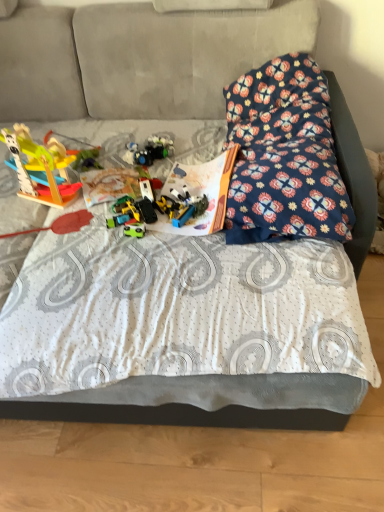
What do you see at coordinates (284, 156) in the screenshot? I see `floral fabric pillow at upper right` at bounding box center [284, 156].

Identify the location of hardcover book at center. (201, 193).

Describe the element at coordinates (126, 217) in the screenshot. I see `shiny plastic toy car at center, placed as the 4th toy when sorted from right to left` at that location.

Locate an element on the screen. The width and height of the screenshot is (384, 512). plastic toy car at center, the sixth toy when ordered from left to right is located at coordinates (181, 206).

Is shiny plastic toy car at center, placed as the 4th toy when sorted from right to left, turned away from green plastic toy car at center, placed as the fourth toy when sorted from left to right?

No, green plastic toy car at center, placed as the fourth toy when sorted from left to right, is not at the back of shiny plastic toy car at center, placed as the 4th toy when sorted from right to left.

Starting from the shiny plastic toy car at center, arranged as the 3th toy when viewed from the left, which toy is the 2nd one in front? Please provide its 2D coordinates.

[(134, 230)]

Is shiny plastic toy car at center, placed as the 4th toy when sorted from right to left, not near green plastic toy car at center, placed as the fourth toy when sorted from left to right?

They are positioned close to each other.

Is shiny plastic toy car at center, placed as the 4th toy when sorted from right to left, shorter than green plastic toy car at center, which is the 3th toy from right to left?

In fact, shiny plastic toy car at center, placed as the 4th toy when sorted from right to left, may be taller than green plastic toy car at center, which is the 3th toy from right to left.

From a real-world perspective, between translucent plastic toys at center, acting as the 2th toy starting from the right, and plastic toy car at center, which is counted as the first toy, starting from the right, who is vertically lower?

plastic toy car at center, which is counted as the first toy, starting from the right, from a real-world perspective.

How much distance is there between translucent plastic toys at center, acting as the 2th toy starting from the right, and plastic toy car at center, which is counted as the first toy, starting from the right?

A distance of 12.71 inches exists between translucent plastic toys at center, acting as the 2th toy starting from the right, and plastic toy car at center, which is counted as the first toy, starting from the right.

Does translucent plastic toys at center, acting as the 2th toy starting from the right, turn towards plastic toy car at center, the sixth toy when ordered from left to right?

Yes, translucent plastic toys at center, acting as the 2th toy starting from the right, is oriented towards plastic toy car at center, the sixth toy when ordered from left to right.

Between point (127, 155) and point (173, 205), which one is positioned in front?

Point (173, 205)

From a real-world perspective, which object rests below the other?

In real-world perspective, green plastic toy car at center, which is the 3th toy from right to left, is lower.

From the image's perspective, which one is positioned higher, green plastic toy at center, placed as the 5th toy when sorted from right to left, or green plastic toy car at center, which is the 3th toy from right to left?

green plastic toy at center, placed as the 5th toy when sorted from right to left, appears higher in the image.

Does green plastic toy at center, placed as the 5th toy when sorted from right to left, come behind green plastic toy car at center, placed as the fourth toy when sorted from left to right?

Yes, the depth of green plastic toy at center, placed as the 5th toy when sorted from right to left, is greater than that of green plastic toy car at center, placed as the fourth toy when sorted from left to right.

Is white textured sheet at center in front of or behind shiny plastic toy car at center, placed as the 4th toy when sorted from right to left, in the image?

In the image, white textured sheet at center appears in front of shiny plastic toy car at center, placed as the 4th toy when sorted from right to left.

Is white textured sheet at center at the right side of shiny plastic toy car at center, arranged as the 3th toy when viewed from the left?

Yes.

Do you think white textured sheet at center is within shiny plastic toy car at center, placed as the 4th toy when sorted from right to left, or outside of it?

The correct answer is: outside.

Is white textured sheet at center wider than shiny plastic toy car at center, placed as the 4th toy when sorted from right to left?

Yes.

From a real-world perspective, between white textured sheet at center and green plastic toy at center, placed as the 5th toy when sorted from right to left, who is vertically higher?

From a 3D spatial view, green plastic toy at center, placed as the 5th toy when sorted from right to left, is above.

Locate an element on the screen. the 5th toy to the left when counting from the white textured sheet at center is located at coordinates tap(87, 160).

Is white textured sheet at center not near green plastic toy at center, placed as the 5th toy when sorted from right to left?

They are positioned close to each other.

From the image's perspective, who appears lower, white textured sheet at center or green plastic toy at center, placed as the 5th toy when sorted from right to left?

white textured sheet at center.

Is shiny plastic toy car at center, placed as the 4th toy when sorted from right to left, bigger than green plastic toy at center, which ranks as the second toy in left-to-right order?

Indeed, shiny plastic toy car at center, placed as the 4th toy when sorted from right to left, has a larger size compared to green plastic toy at center, which ranks as the second toy in left-to-right order.

Is point (128, 228) positioned in front of point (81, 167)?

Yes, point (128, 228) is closer to viewer.

From a real-world perspective, who is located higher, shiny plastic toy car at center, placed as the 4th toy when sorted from right to left, or green plastic toy at center, placed as the 5th toy when sorted from right to left?

green plastic toy at center, placed as the 5th toy when sorted from right to left, from a real-world perspective.

Can you confirm if shiny plastic toy car at center, arranged as the 3th toy when viewed from the left, is shorter than green plastic toy at center, placed as the 5th toy when sorted from right to left?

Incorrect, the height of shiny plastic toy car at center, arranged as the 3th toy when viewed from the left, does not fall short of that of green plastic toy at center, placed as the 5th toy when sorted from right to left.

Does shiny plastic toy car at center, placed as the 4th toy when sorted from right to left, turn towards wooden toy at left, which is the sixth toy in right-to-left order?

No, shiny plastic toy car at center, placed as the 4th toy when sorted from right to left, is not turned towards wooden toy at left, which is the sixth toy in right-to-left order.

Looking at their sizes, would you say shiny plastic toy car at center, arranged as the 3th toy when viewed from the left, is wider or thinner than wooden toy at left, the first toy viewed from the left?

shiny plastic toy car at center, arranged as the 3th toy when viewed from the left, is wider than wooden toy at left, the first toy viewed from the left.

In the scene shown: Does shiny plastic toy car at center, arranged as the 3th toy when viewed from the left, lie behind wooden toy at left, which is the sixth toy in right-to-left order?

Yes, shiny plastic toy car at center, arranged as the 3th toy when viewed from the left, is further from the viewer.

Does shiny plastic toy car at center, arranged as the 3th toy when viewed from the left, have a greater height compared to wooden toy at left, the first toy viewed from the left?

No.

I want to click on the 2nd toy behind the green plastic toy car at center, which is the 3th toy from right to left, so click(x=126, y=217).

The height and width of the screenshot is (512, 384). I want to click on the 3rd toy above the plastic toy car at center, which is counted as the first toy, starting from the right (from the image's perspective), so click(x=149, y=151).

From the image, which object appears to be farther from hardcover book at center, wooden toy at left, which is the sixth toy in right-to-left order, or plastic toy car at center, which is counted as the first toy, starting from the right?

wooden toy at left, which is the sixth toy in right-to-left order.

Based on their spatial positions, is plastic toy car at center, which is counted as the first toy, starting from the right, or white textured sheet at center closer to wooden toy at left, which is the sixth toy in right-to-left order?

plastic toy car at center, which is counted as the first toy, starting from the right, is positioned closer to the anchor wooden toy at left, which is the sixth toy in right-to-left order.

Which object lies nearer to the anchor point white textured sheet at center, translucent plastic toys at center, acting as the 2th toy starting from the right, or plastic toy car at center, the sixth toy when ordered from left to right?

plastic toy car at center, the sixth toy when ordered from left to right, lies closer to white textured sheet at center than the other object.

Considering their positions, is translucent plastic toys at center, acting as the 5th toy starting from the left, positioned further to green plastic toy car at center, placed as the fourth toy when sorted from left to right, than wooden toy at left, the first toy viewed from the left?

translucent plastic toys at center, acting as the 5th toy starting from the left, is further to green plastic toy car at center, placed as the fourth toy when sorted from left to right.

Looking at the image, which one is located further to white textured sheet at center, wooden toy at left, the first toy viewed from the left, or translucent plastic toys at center, acting as the 5th toy starting from the left?

translucent plastic toys at center, acting as the 5th toy starting from the left, is further to white textured sheet at center.

When comparing their distances from floral fabric pillow at upper right, does green plastic toy car at center, which is the 3th toy from right to left, or white textured sheet at center seem further?

green plastic toy car at center, which is the 3th toy from right to left, is further to floral fabric pillow at upper right.

Which object lies nearer to the anchor point floral fabric pillow at upper right, shiny plastic toy car at center, arranged as the 3th toy when viewed from the left, or hardcover book at center?

hardcover book at center lies closer to floral fabric pillow at upper right than the other object.

In the scene shown: Considering their positions, is shiny plastic toy car at center, arranged as the 3th toy when viewed from the left, positioned further to hardcover book at center than white textured sheet at center?

Based on the image, white textured sheet at center appears to be further to hardcover book at center.

Locate an element on the screen. The image size is (384, 512). book between green plastic toy car at center, which is the 3th toy from right to left, and floral fabric pillow at upper right, in the horizontal direction is located at coordinates (201, 193).

I want to click on book between plastic toy car at center, which is counted as the first toy, starting from the right, and floral fabric pillow at upper right from left to right, so click(x=201, y=193).

You are a GUI agent. You are given a task and a screenshot of the screen. Output one action in this format:
    pyautogui.click(x=<x>, y=<y>)
    Task: Click on the toy between shiny plastic toy car at center, arranged as the 3th toy when viewed from the left, and white textured sheet at center in the up-down direction
    The image size is (384, 512).
    Given the screenshot: What is the action you would take?
    pyautogui.click(x=134, y=230)

Where is `sheet located between wooden toy at left, which is the sixth toy in right-to-left order, and floral fabric pillow at upper right in the left-right direction`? This screenshot has width=384, height=512. sheet located between wooden toy at left, which is the sixth toy in right-to-left order, and floral fabric pillow at upper right in the left-right direction is located at coordinates (185, 324).